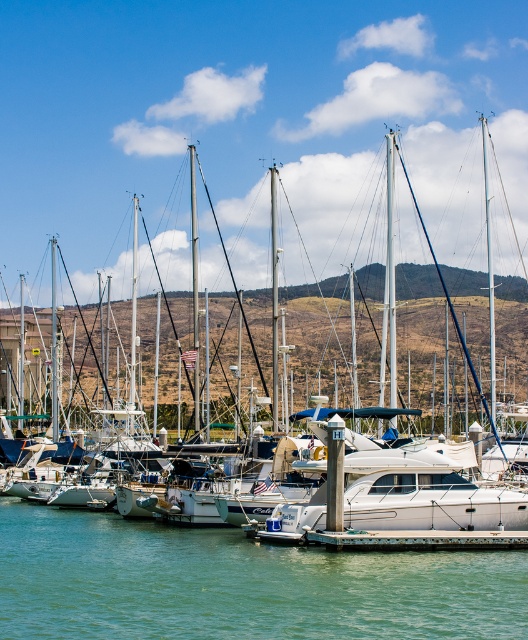
From the picture: Does green water at center lie behind white glossy sailboat at center?

No, it is in front of white glossy sailboat at center.

Can you confirm if green water at center is thinner than white glossy sailboat at center?

Yes.

The width and height of the screenshot is (528, 640). Find the location of `green water at center`. green water at center is located at coordinates (239, 584).

Who is higher up, white glossy sailboat at center or rustic wood dock at center?

white glossy sailboat at center

Which is behind, point (193, 253) or point (371, 540)?

The point (193, 253) is behind.

Does point (389, 266) lie behind point (337, 532)?

Yes.

Where is `white glossy sailboat at center`? The height and width of the screenshot is (640, 528). white glossy sailboat at center is located at coordinates (438, 278).

What do you see at coordinates (239, 584) in the screenshot?
I see `green water at center` at bounding box center [239, 584].

What are the coordinates of `green water at center` in the screenshot? It's located at (239, 584).

Locate an element on the screen. The height and width of the screenshot is (640, 528). green water at center is located at coordinates (239, 584).